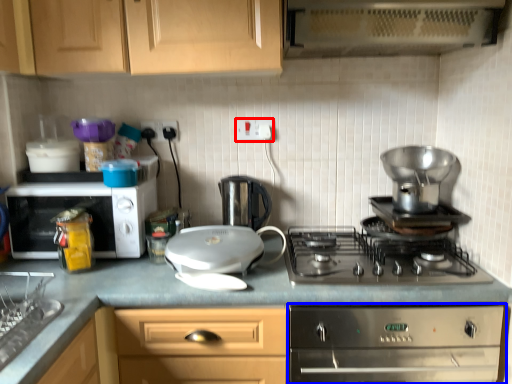
Question: Among these objects, which one is nearest to the camera, electric outlet (highlighted by a red box) or home appliance (highlighted by a blue box)?

Choices:
 (A) electric outlet
 (B) home appliance

Answer: (B)